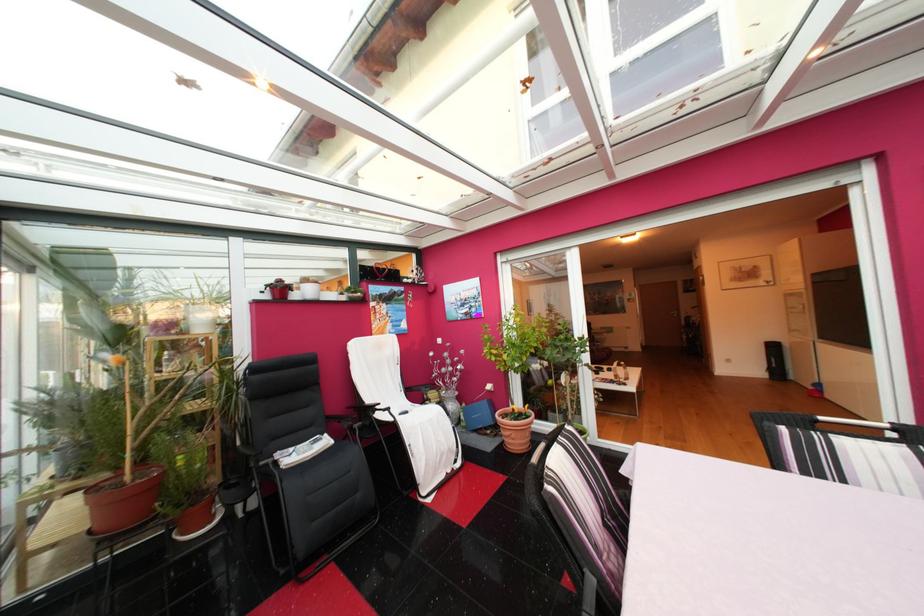
The width and height of the screenshot is (924, 616). I want to click on black chair armrest, so click(301, 468).